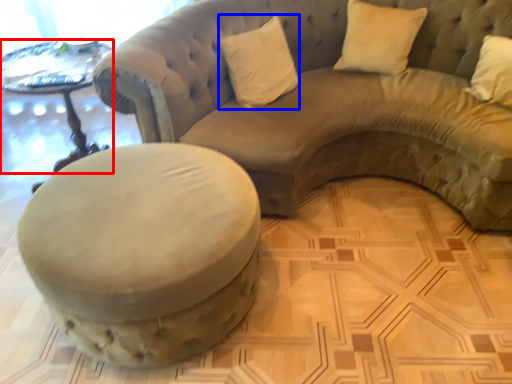
Question: Among these objects, which one is farthest to the camera, table (highlighted by a red box) or pillow (highlighted by a blue box)?

Choices:
 (A) table
 (B) pillow

Answer: (B)